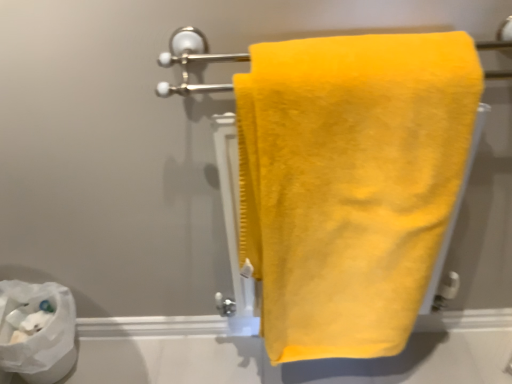
Question: From the image's perspective, is white paper at lower left under yellow fluffy towel at center?

Choices:
 (A) yes
 (B) no

Answer: (A)

Question: Can you confirm if white paper at lower left is thinner than yellow fluffy towel at center?

Choices:
 (A) no
 (B) yes

Answer: (B)

Question: Is white paper at lower left not close to yellow fluffy towel at center?

Choices:
 (A) yes
 (B) no

Answer: (B)

Question: Does white paper at lower left lie behind yellow fluffy towel at center?

Choices:
 (A) yes
 (B) no

Answer: (A)

Question: Is white paper at lower left turned away from yellow fluffy towel at center?

Choices:
 (A) yes
 (B) no

Answer: (B)

Question: Is white paper at lower left wider than yellow fluffy towel at center?

Choices:
 (A) no
 (B) yes

Answer: (A)

Question: Are satin yellow towel at center and yellow fluffy towel at center located far from each other?

Choices:
 (A) yes
 (B) no

Answer: (B)

Question: Does satin yellow towel at center appear on the right side of yellow fluffy towel at center?

Choices:
 (A) yes
 (B) no

Answer: (B)

Question: Is satin yellow towel at center taller than yellow fluffy towel at center?

Choices:
 (A) no
 (B) yes

Answer: (A)

Question: Does satin yellow towel at center have a greater width compared to yellow fluffy towel at center?

Choices:
 (A) yes
 (B) no

Answer: (B)

Question: Does satin yellow towel at center turn towards yellow fluffy towel at center?

Choices:
 (A) yes
 (B) no

Answer: (A)

Question: Is satin yellow towel at center looking in the opposite direction of yellow fluffy towel at center?

Choices:
 (A) no
 (B) yes

Answer: (B)

Question: Is white paper at lower left further to the viewer compared to satin yellow towel at center?

Choices:
 (A) no
 (B) yes

Answer: (B)